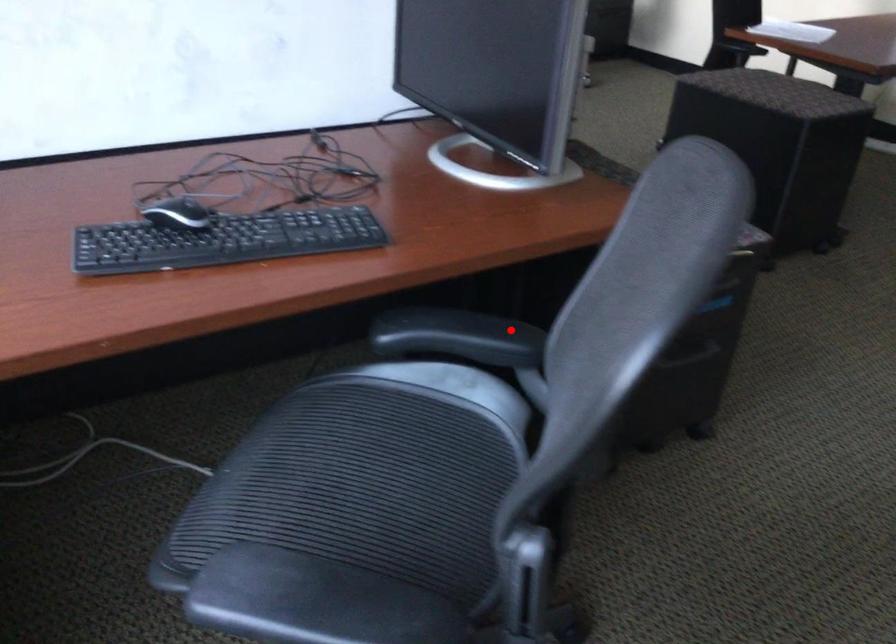
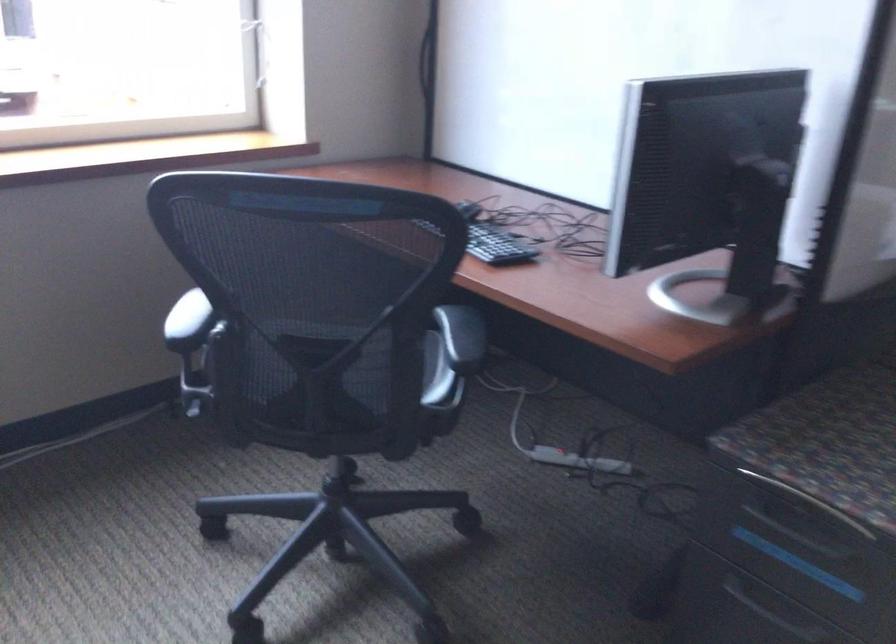
Question: I am providing you with two images of the same scene from different viewpoints. Image1 has a red point marked. In image2, the corresponding 3D location appears at what relative position? Reply with the corresponding letter.

Choices:
 (A) Closer
 (B) Farther

Answer: (B)